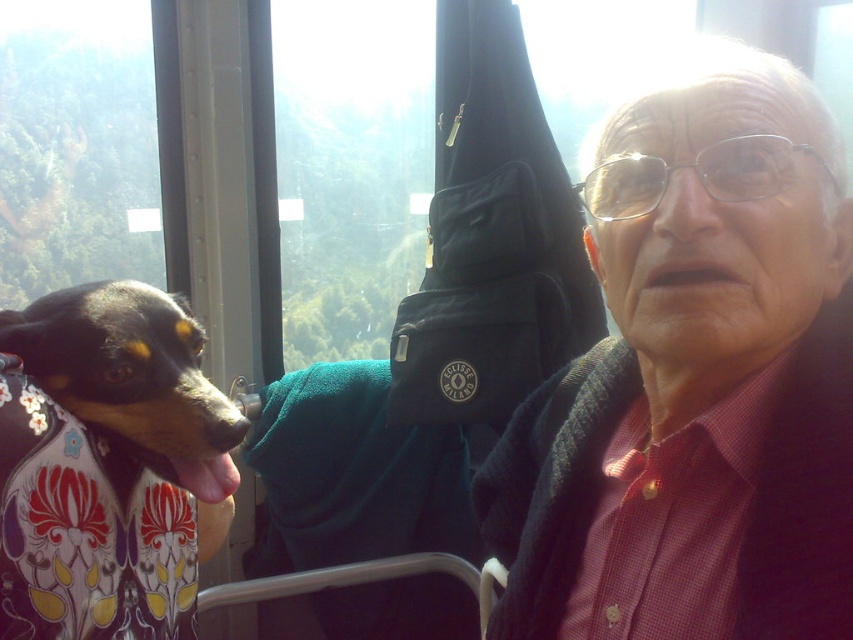
You are a passenger in the cable car and want to place a small backpack on the seat. Which object, the matte black jacket at center or the smooth black and tan dog at left, is a better choice for placing the backpack?

The matte black jacket at center is much taller than the smooth black and tan dog at left, so placing the backpack on the matte black jacket at center would provide a more stable and elevated surface compared to the dog.

You are a passenger in the cable car and need to reach the smooth black and tan dog at left to ask its owner about the next stop. The matte black jacket at center is blocking your path. Is the dog to the left or right of the jacket?

The smooth black and tan dog at left is to the left of the matte black jacket at center.

You are a passenger in the cable car and want to place your new matte black jacket at center on the seat. The seat is 0.6 meters wide. Can you fit the jacket on the seat?

The 2D location of matte black jacket at center is at point (695, 381). This means the jacket can fit on the seat since its width is less than the seat width of 0.6 meters.